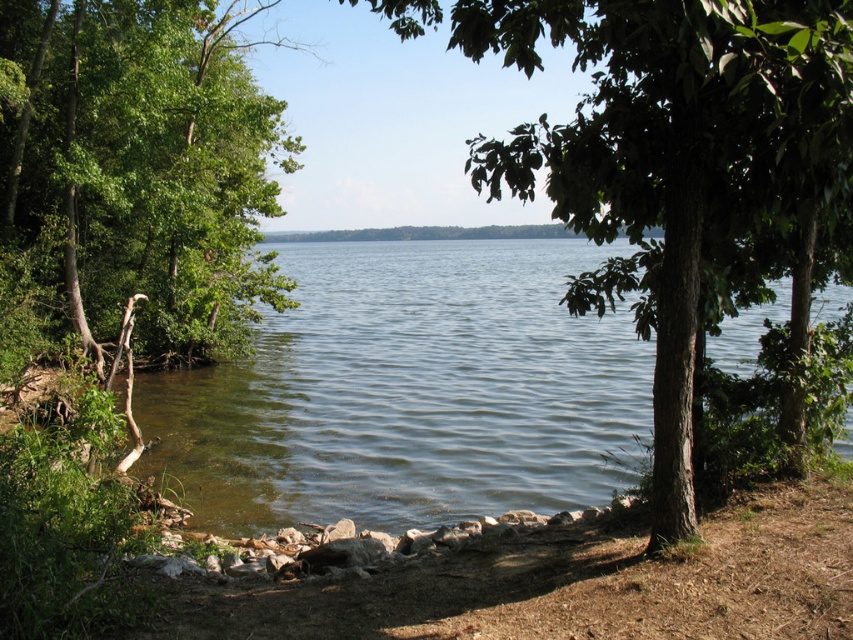
Question: Which object is closer to the camera taking this photo?

Choices:
 (A) smooth dirt shoreline at lower center
 (B) green leafy tree at left
 (C) green rough bark tree at center

Answer: (C)

Question: Does clear water at center appear on the right side of green leafy tree at left?

Choices:
 (A) no
 (B) yes

Answer: (B)

Question: Which point is closer to the camera?

Choices:
 (A) smooth dirt shoreline at lower center
 (B) clear water at center
 (C) green leafy tree at left
 (D) green rough bark tree at center

Answer: (D)

Question: Among these objects, which one is nearest to the camera?

Choices:
 (A) green rough bark tree at center
 (B) clear water at center
 (C) green leafy tree at left

Answer: (A)

Question: Can you confirm if clear water at center is positioned to the right of green leafy tree at left?

Choices:
 (A) yes
 (B) no

Answer: (A)

Question: Is clear water at center closer to the viewer compared to smooth dirt shoreline at lower center?

Choices:
 (A) no
 (B) yes

Answer: (A)